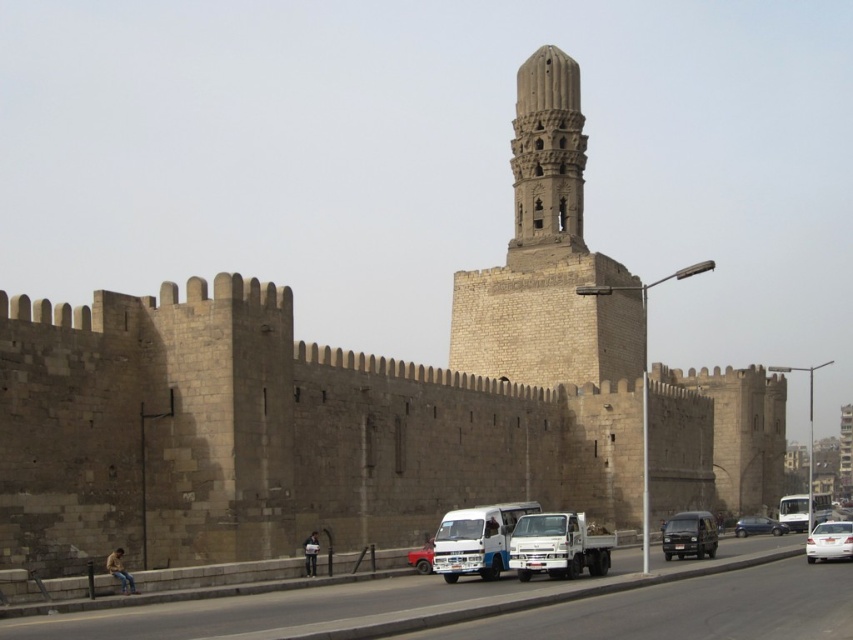
Question: Which of the following is the closest to the observer?

Choices:
 (A) (577, 86)
 (B) (680, 524)
 (C) (558, 120)
 (D) (424, 568)

Answer: (D)

Question: Among these objects, which one is nearest to the camera?

Choices:
 (A) dark gray matte van at lower right
 (B) matte red truck at center
 (C) brown stone tower at center

Answer: (B)

Question: Can you confirm if dark gray matte van at lower right is bigger than metallic blue sedan at lower right?

Choices:
 (A) yes
 (B) no

Answer: (A)

Question: Is brown stone tower at center positioned at the back of matte red truck at center?

Choices:
 (A) no
 (B) yes

Answer: (B)

Question: Is the position of dark gray matte van at lower right less distant than that of matte red truck at center?

Choices:
 (A) yes
 (B) no

Answer: (B)

Question: Which of these objects is positioned farthest from the gray stone tower at center?

Choices:
 (A) brown stone tower at center
 (B) matte red truck at center
 (C) dark gray matte van at lower right

Answer: (B)